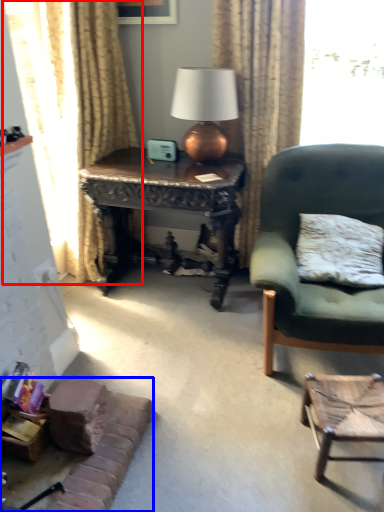
Question: Which point is closer to the camera, curtain (highlighted by a red box) or couch (highlighted by a blue box)?

Choices:
 (A) curtain
 (B) couch

Answer: (B)